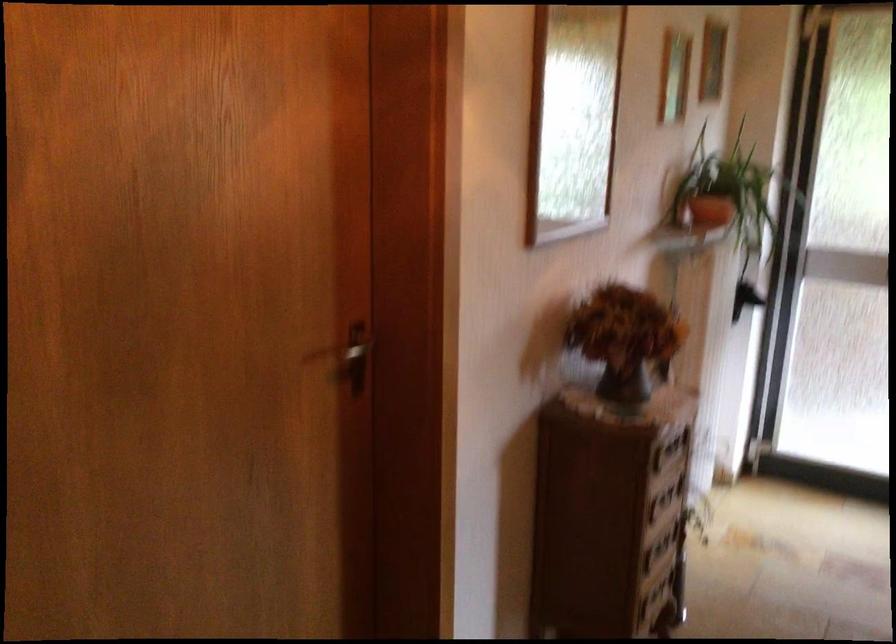
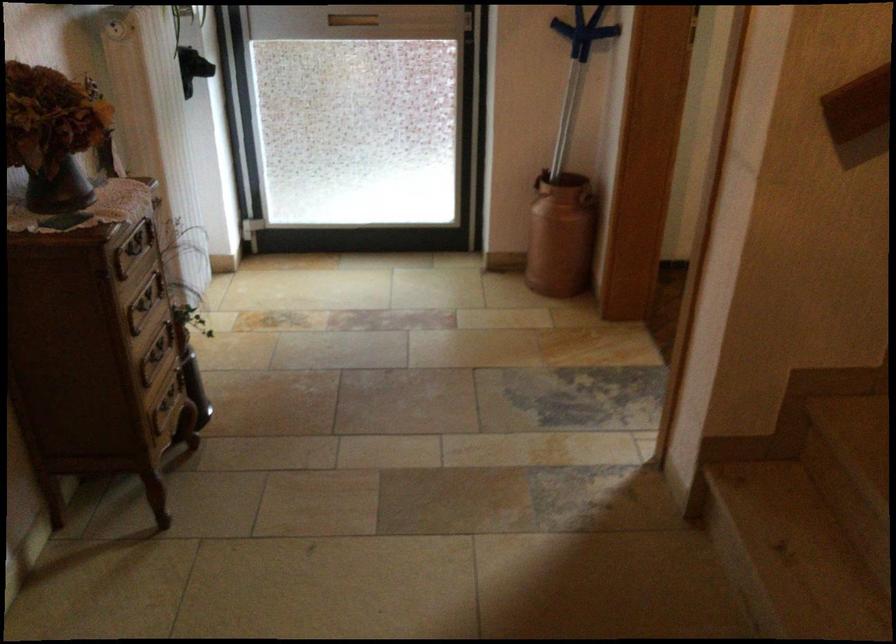
The point at (636,343) is marked in the first image. Where is the corresponding point in the second image?

(53, 134)